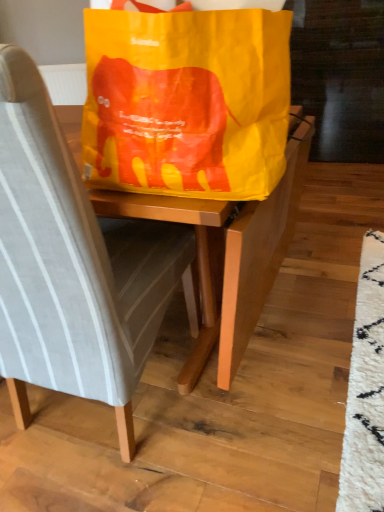
Question: Is yellow paper grocery bag at center facing away from light gray fabric chair at center?

Choices:
 (A) yes
 (B) no

Answer: (B)

Question: Is light gray fabric chair at center located within yellow paper grocery bag at center?

Choices:
 (A) yes
 (B) no

Answer: (B)

Question: Does yellow paper grocery bag at center come in front of light gray fabric chair at center?

Choices:
 (A) yes
 (B) no

Answer: (B)

Question: Considering the relative sizes of yellow paper grocery bag at center and light gray fabric chair at center in the image provided, is yellow paper grocery bag at center taller than light gray fabric chair at center?

Choices:
 (A) no
 (B) yes

Answer: (A)

Question: Is yellow paper grocery bag at center with light gray fabric chair at center?

Choices:
 (A) yes
 (B) no

Answer: (B)

Question: From the image's perspective, is yellow paper grocery bag at center on light gray fabric chair at center?

Choices:
 (A) yes
 (B) no

Answer: (A)

Question: Is light gray fabric chair at center aimed at yellow paper grocery bag at center?

Choices:
 (A) yes
 (B) no

Answer: (B)

Question: Can we say light gray fabric chair at center lies outside yellow paper grocery bag at center?

Choices:
 (A) yes
 (B) no

Answer: (A)

Question: From a real-world perspective, does light gray fabric chair at center sit lower than yellow paper grocery bag at center?

Choices:
 (A) yes
 (B) no

Answer: (A)

Question: From the image's perspective, is light gray fabric chair at center on top of yellow paper grocery bag at center?

Choices:
 (A) no
 (B) yes

Answer: (A)

Question: Considering the relative sizes of light gray fabric chair at center and yellow paper grocery bag at center in the image provided, is light gray fabric chair at center bigger than yellow paper grocery bag at center?

Choices:
 (A) no
 (B) yes

Answer: (B)

Question: Is light gray fabric chair at center far from yellow paper grocery bag at center?

Choices:
 (A) no
 (B) yes

Answer: (A)

Question: Looking at their shapes, would you say light gray fabric chair at center is wider or thinner than yellow paper grocery bag at center?

Choices:
 (A) thin
 (B) wide

Answer: (B)